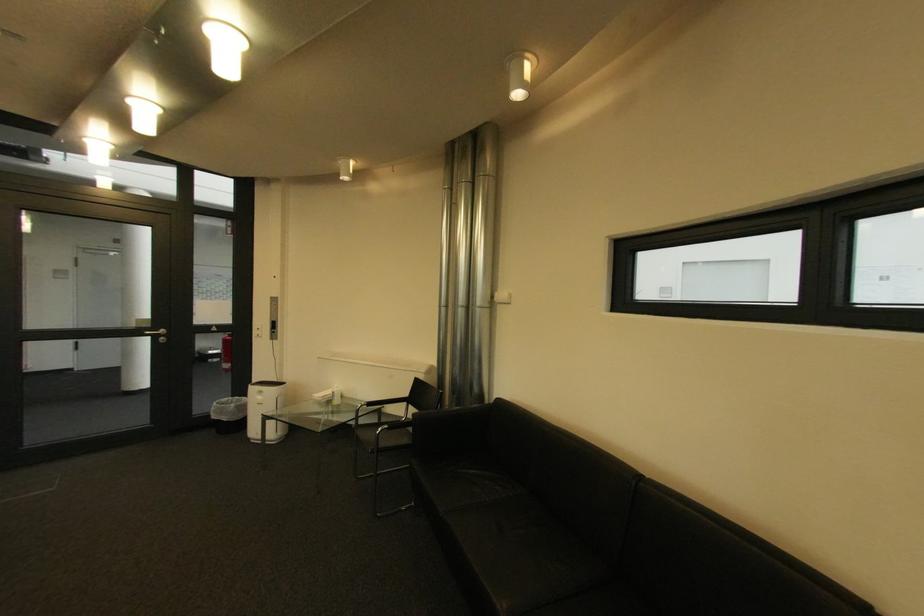
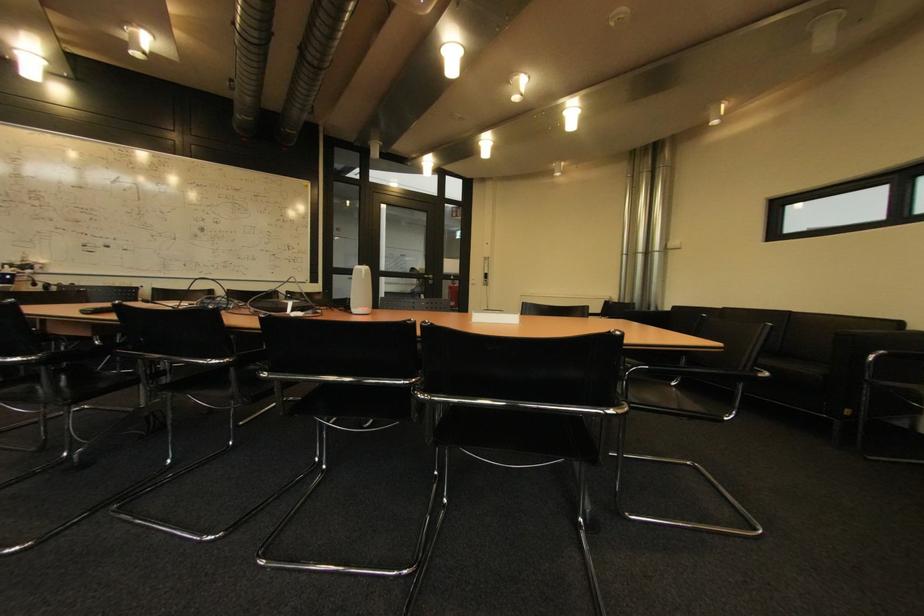
The point at (213,330) is marked in the first image. Where is the corresponding point in the second image?

(456, 278)